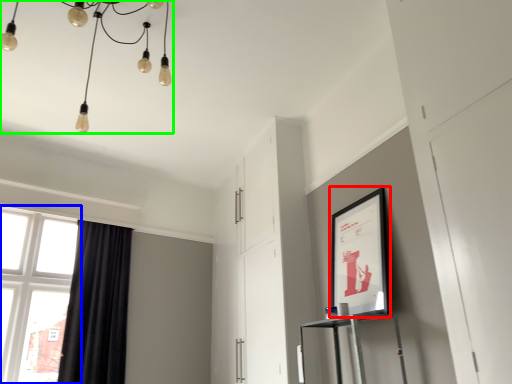
Question: Which is nearer to the picture frame (highlighted by a red box)? window (highlighted by a blue box) or lamp (highlighted by a green box).

Choices:
 (A) window
 (B) lamp

Answer: (B)